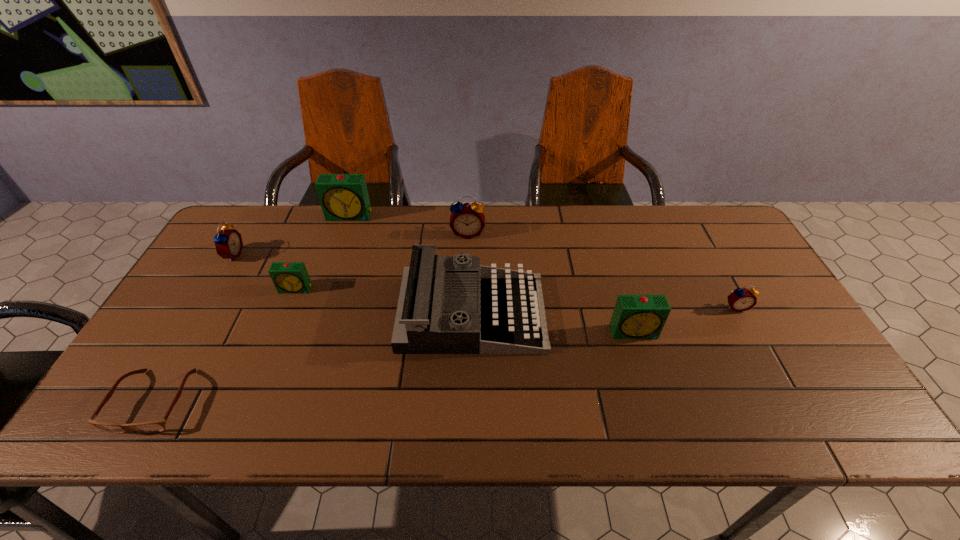
This screenshot has height=540, width=960. Identify the location of alarm clock that stands as the second closest to the rightmost green alarm clock. (467, 220).

Identify the location of alarm clock object that ranks as the fifth closest to the biggest red alarm clock. The image size is (960, 540). (741, 299).

Locate which red alarm clock is the second closest to the rightmost green alarm clock. Please provide its 2D coordinates. Your answer should be formatted as a tuple, i.e. [(x, y)], where the tuple contains the x and y coordinates of a point satisfying the conditions above.

[(467, 220)]

Choose which red alarm clock is the third nearest neighbor to the seventh object from left to right. Please provide its 2D coordinates. Your answer should be formatted as a tuple, i.e. [(x, y)], where the tuple contains the x and y coordinates of a point satisfying the conditions above.

[(228, 242)]

Identify the location of the closest green alarm clock to the second biggest red alarm clock. Image resolution: width=960 pixels, height=540 pixels. (288, 277).

Select which green alarm clock appears as the closest to the nearest red alarm clock. Please provide its 2D coordinates. Your answer should be formatted as a tuple, i.e. [(x, y)], where the tuple contains the x and y coordinates of a point satisfying the conditions above.

[(635, 316)]

Locate an element on the screen. The image size is (960, 540). vacant space that satisfies the following two spatial constraints: 1. on the front-facing side of the fifth nearest alarm clock; 2. on the front-facing side of the second smallest red alarm clock is located at coordinates (468, 255).

Where is `free spot that satisfies the following two spatial constraints: 1. on the front-facing side of the farthest green alarm clock; 2. on the front-facing side of the second farthest red alarm clock`? The image size is (960, 540). free spot that satisfies the following two spatial constraints: 1. on the front-facing side of the farthest green alarm clock; 2. on the front-facing side of the second farthest red alarm clock is located at coordinates (336, 255).